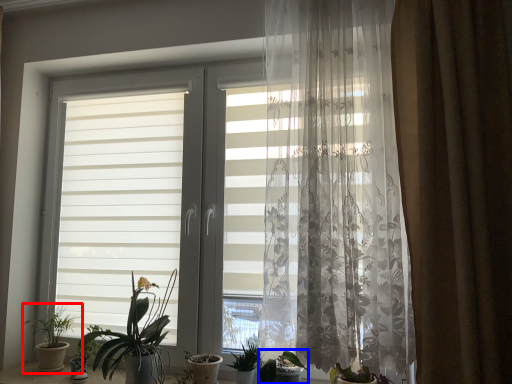
Question: Which of the following is the farthest to the observer, houseplant (highlighted by a red box) or houseplant (highlighted by a blue box)?

Choices:
 (A) houseplant
 (B) houseplant

Answer: (A)